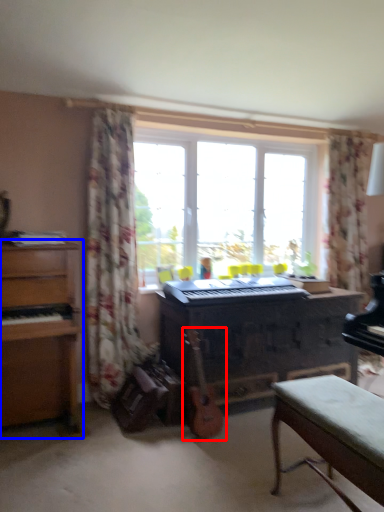
Question: Which point is closer to the camera, guitar (highlighted by a red box) or chest of drawers (highlighted by a blue box)?

Choices:
 (A) guitar
 (B) chest of drawers

Answer: (B)